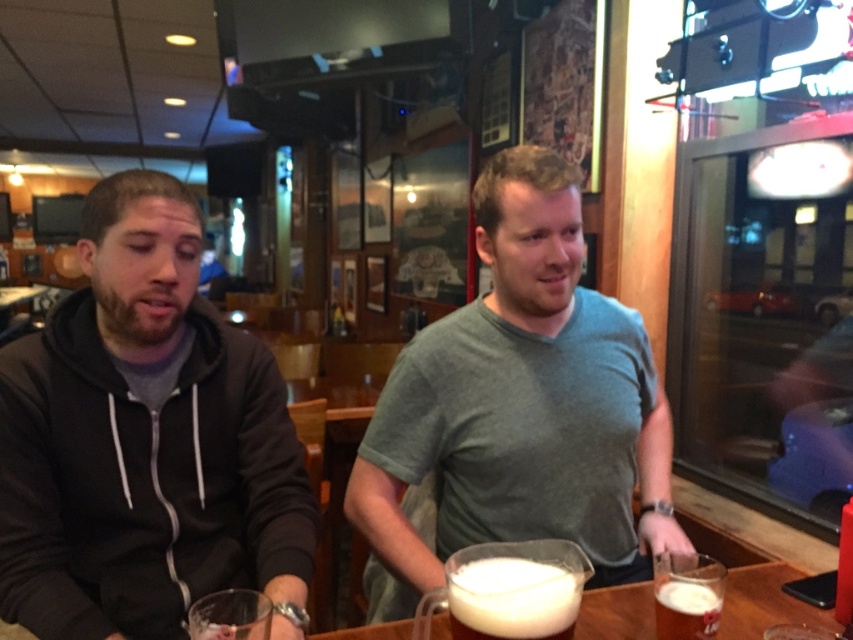
Does gray matte shirt at center have a smaller size compared to white frothy liquid at center?

Actually, gray matte shirt at center might be larger than white frothy liquid at center.

Who is shorter, gray matte shirt at center or white frothy liquid at center?

white frothy liquid at center is shorter.

Locate an element on the screen. The width and height of the screenshot is (853, 640). gray matte shirt at center is located at coordinates (520, 404).

Locate an element on the screen. gray matte shirt at center is located at coordinates (520, 404).

Can you confirm if dark gray hoodie at left is smaller than white frothy liquid at lower right?

No.

Does dark gray hoodie at left appear on the right side of white frothy liquid at lower right?

No, dark gray hoodie at left is not to the right of white frothy liquid at lower right.

Which is behind, point (102, 262) or point (660, 620)?

The point (102, 262) is behind.

The width and height of the screenshot is (853, 640). What are the coordinates of `dark gray hoodie at left` in the screenshot? It's located at (144, 440).

Can you confirm if dark gray hoodie at left is positioned to the right of gray matte shirt at center?

Incorrect, dark gray hoodie at left is not on the right side of gray matte shirt at center.

Is dark gray hoodie at left bigger than gray matte shirt at center?

No, dark gray hoodie at left is not bigger than gray matte shirt at center.

The width and height of the screenshot is (853, 640). Describe the element at coordinates (144, 440) in the screenshot. I see `dark gray hoodie at left` at that location.

Find the location of `dark gray hoodie at left`. dark gray hoodie at left is located at coordinates (144, 440).